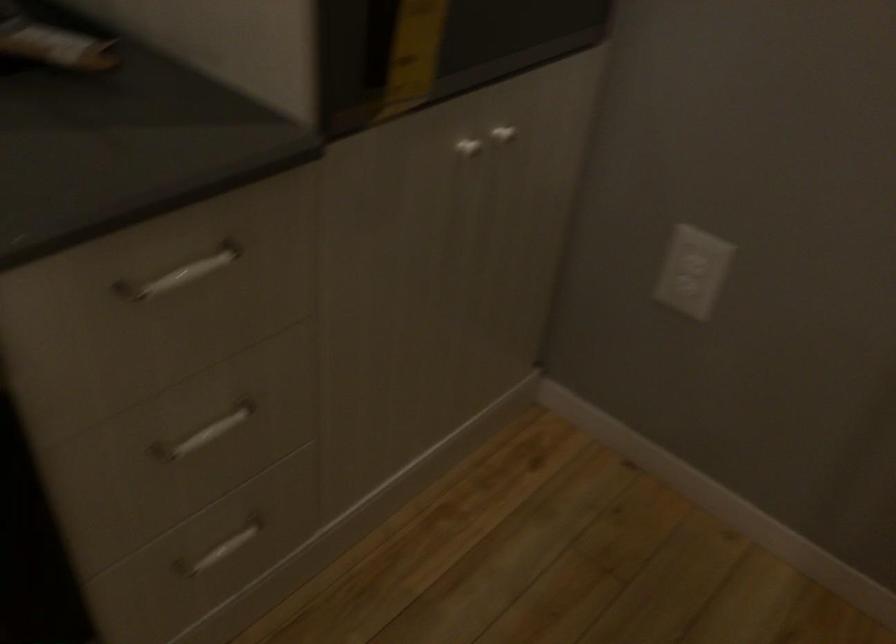
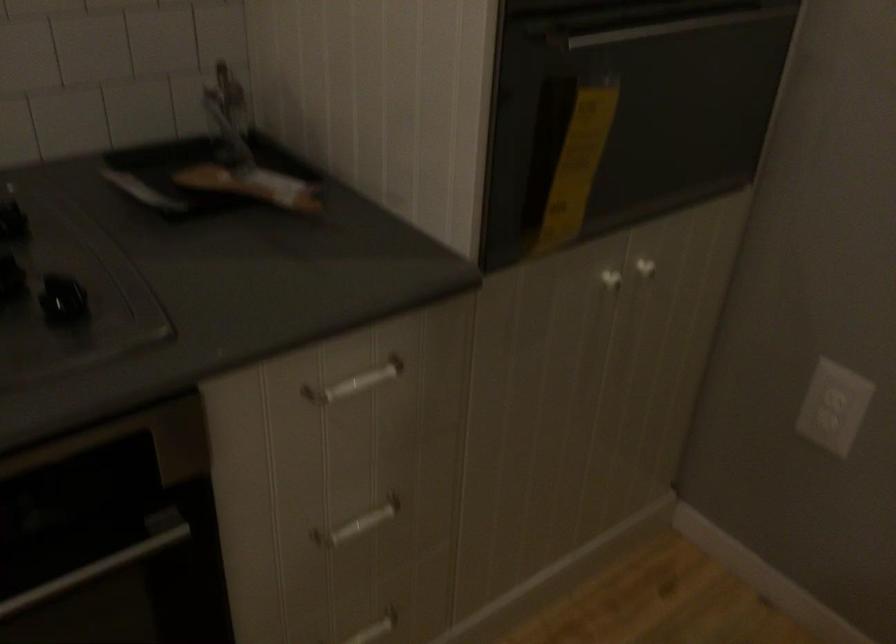
The point at (469, 144) is marked in the first image. Where is the corresponding point in the second image?

(609, 278)